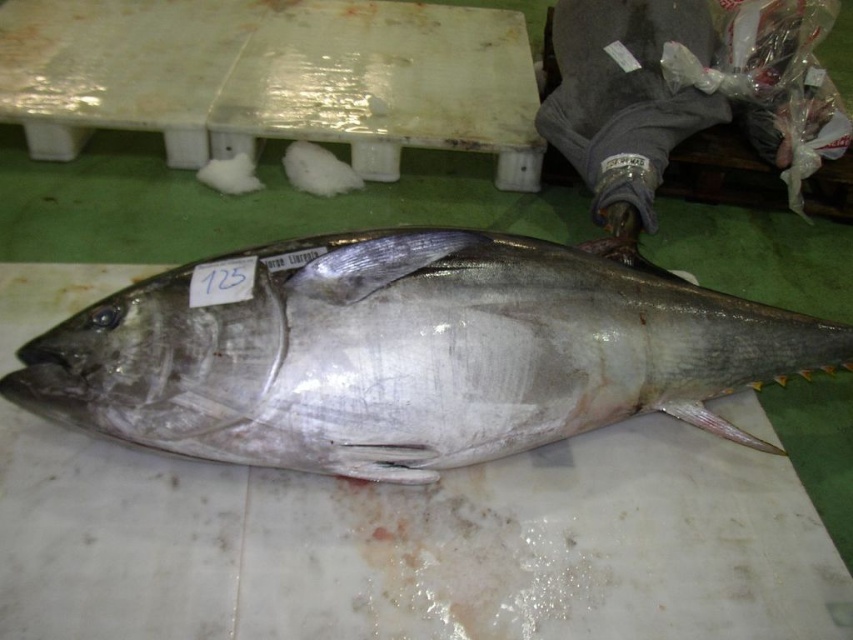
Can you confirm if shiny silver fish at center is bigger than white plastic table at center?

No.

Is point (325, 356) in front of point (21, 68)?

Yes, it is in front of point (21, 68).

The width and height of the screenshot is (853, 640). Identify the location of shiny silver fish at center. (405, 353).